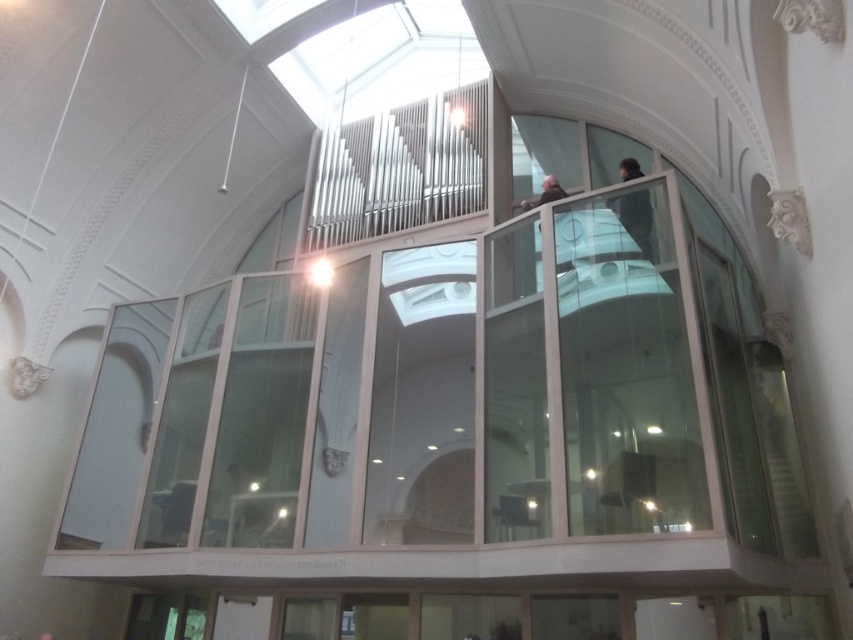
You are standing at the base of the glass structure in the image and notice a dark gray fabric jacket at upper right and a camera. Which object is closer to you?

The dark gray fabric jacket at upper right is closer to you than the camera because they are 5.89 meters apart, but without knowing their exact positions relative to your location, it is impossible to determine which is closer.

You are an interior designer working on a project and need to place a new decorative item in the scene. The item must be placed exactly where the dark gray fabric jacket at upper right is currently located. What are the coordinates of the location where you should place the new item?

The coordinates for the dark gray fabric jacket at upper right are at point (636, 220), so you should place the new item at those coordinates.

You are standing at the entrance of the grand space and see two points marked on the floor. The first point is at coordinate point (645, 192) and the second is at point (543, 192). If you walk towards the back of the room, which point will you step on first?

Point (543, 192) will be stepped on first because point (645, 192) is in front of it, meaning it is closer to the entrance.